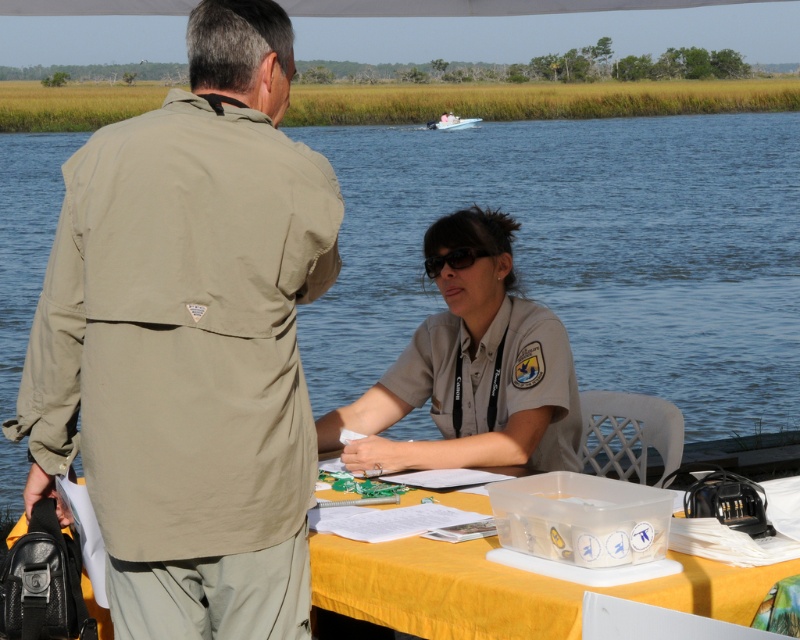
You are a visitor at the water body and see the khaki fabric jacket at left and the tan uniform at center. Which clothing item is positioned higher in the image?

The khaki fabric jacket at left is positioned higher in the image as it is above the tan uniform at center.

You are standing at the edge of the water and want to place a 3.5 meter long wooden board so that it reaches from where you are standing to the blue water at center. Is the board long enough to reach the water?

The blue water at center is 3.63 meters from viewer. The wooden board is 3.5 meters long, which is shorter than the distance to the water. Therefore, the board is not long enough to reach the water.

Where is the khaki fabric jacket at left located in the image?

The khaki fabric jacket at left is located at point (190, 340) in the image.